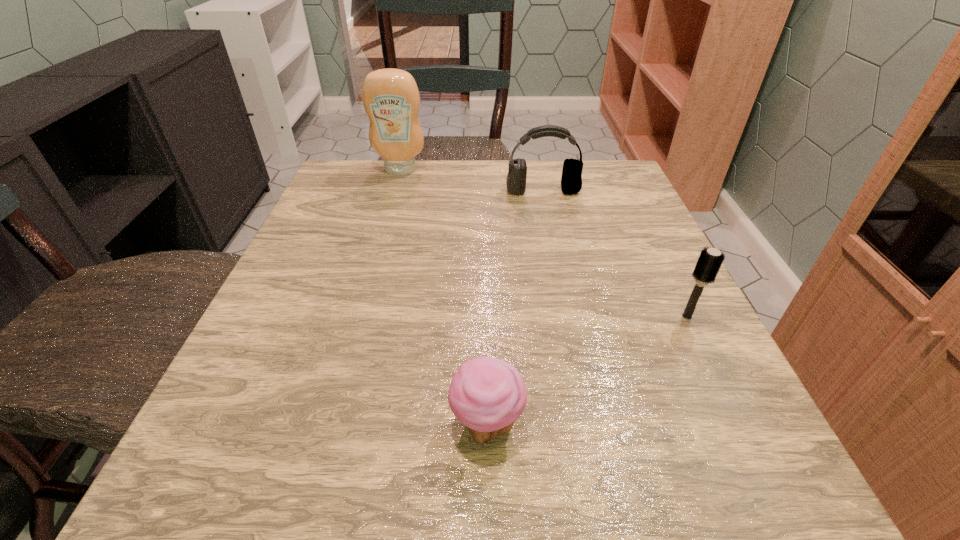
At what (x,y) coordinates should I click in order to perform the action: click on the leftmost object. Please return your answer as a coordinate pair (x, y). This screenshot has height=540, width=960. Looking at the image, I should click on (391, 99).

You are a GUI agent. You are given a task and a screenshot of the screen. Output one action in this format:
    pyautogui.click(x=<x>, y=<y>)
    Task: Click on the condiment
    The height and width of the screenshot is (540, 960).
    Given the screenshot: What is the action you would take?
    pyautogui.click(x=391, y=99)

I want to click on the third nearest object, so click(x=571, y=181).

Locate an element on the screen. Image resolution: width=960 pixels, height=540 pixels. the third object from left to right is located at coordinates (571, 181).

Find the location of a particular element. The width and height of the screenshot is (960, 540). the second shortest object is located at coordinates (710, 260).

Locate an element on the screen. This screenshot has width=960, height=540. the third farthest object is located at coordinates (710, 260).

Where is `cupcake`? The width and height of the screenshot is (960, 540). cupcake is located at coordinates (487, 395).

At what (x,y) coordinates should I click in order to perform the action: click on the second object from left to right. Please return your answer as a coordinate pair (x, y). Image resolution: width=960 pixels, height=540 pixels. Looking at the image, I should click on (487, 395).

What are the coordinates of `vacant area situated on the label of the leftmost object` in the screenshot? It's located at (394, 194).

Find the location of a particular element. The height and width of the screenshot is (540, 960). vacant region located on the headband of the third nearest object is located at coordinates (557, 256).